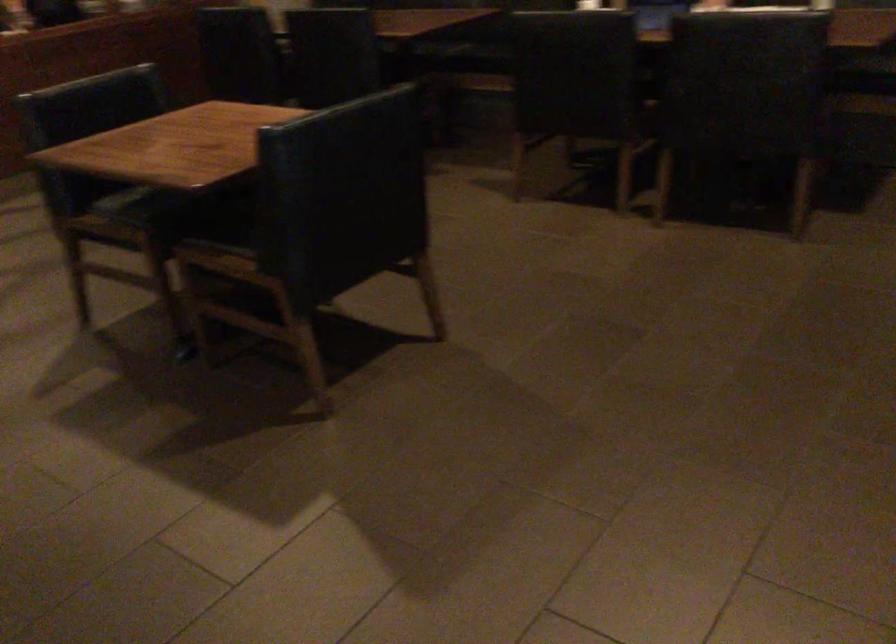
You are a GUI agent. You are given a task and a screenshot of the screen. Output one action in this format:
    pyautogui.click(x=<x>, y=<y>)
    Task: Click on the black chair sitting surface
    The height and width of the screenshot is (644, 896).
    Given the screenshot: What is the action you would take?
    pyautogui.click(x=266, y=234)